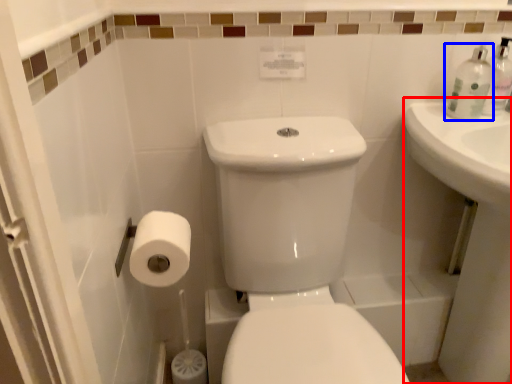
Question: Among these objects, which one is farthest to the camera, counter top (highlighted by a red box) or toiletry (highlighted by a blue box)?

Choices:
 (A) counter top
 (B) toiletry

Answer: (B)